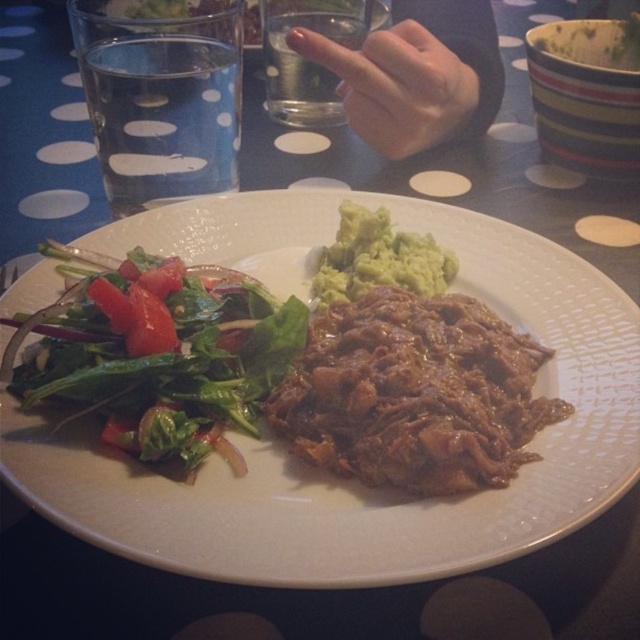
Does brown glossy shredded beef at center appear on the right side of green leafymaterial/texturesalad at left?

Yes, brown glossy shredded beef at center is to the right of green leafymaterial/texturesalad at left.

Is brown glossy shredded beef at center to the left of green leafymaterial/texturesalad at left from the viewer's perspective?

Incorrect, brown glossy shredded beef at center is not on the left side of green leafymaterial/texturesalad at left.

Between point (420, 339) and point (260, 365), which one is positioned in front?

Point (420, 339)

This screenshot has height=640, width=640. I want to click on brown glossy shredded beef at center, so click(x=413, y=394).

Between green leafymaterial/texturesalad at left and green creamy guacamole at center, which one is positioned higher?

green creamy guacamole at center is above.

Which is in front, point (220, 272) or point (376, 214)?

Point (220, 272) is in front.

This screenshot has width=640, height=640. I want to click on green leafymaterial/texturesalad at left, so click(161, 355).

Can you confirm if white matte plate at center is positioned to the left of green creamy guacamole at center?

Indeed, white matte plate at center is positioned on the left side of green creamy guacamole at center.

Measure the distance from white matte plate at center to green creamy guacamole at center.

white matte plate at center is 12.50 centimeters from green creamy guacamole at center.

Where is `white matte plate at center`? Image resolution: width=640 pixels, height=640 pixels. white matte plate at center is located at coordinates (326, 474).

This screenshot has height=640, width=640. I want to click on white matte plate at center, so click(x=326, y=474).